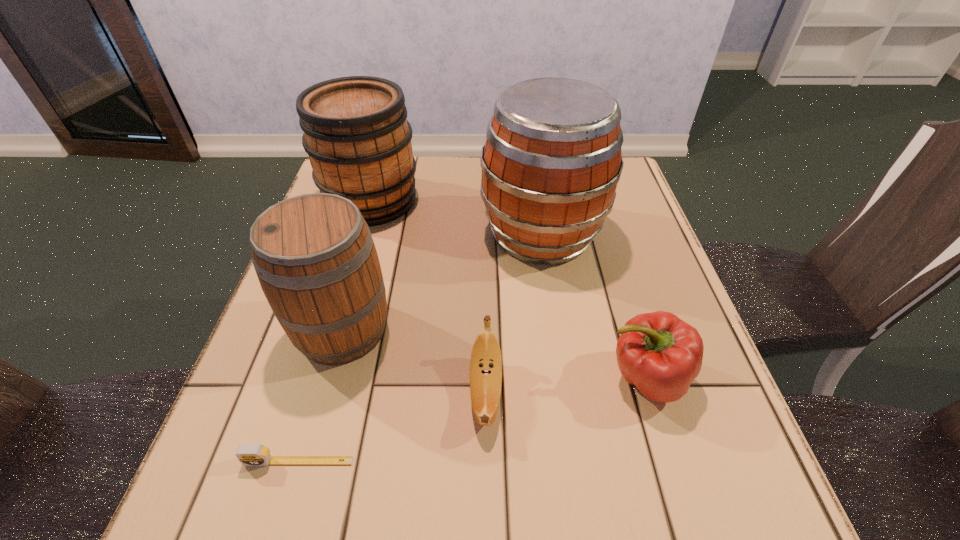
Where is `vacant area that lies between the rightmost cider and the nearest cider`? The height and width of the screenshot is (540, 960). vacant area that lies between the rightmost cider and the nearest cider is located at coordinates (442, 282).

Image resolution: width=960 pixels, height=540 pixels. I want to click on vacant point located between the nearest cider and the rightmost cider, so click(442, 282).

The image size is (960, 540). I want to click on vacant area that lies between the fourth tallest object and the rightmost cider, so click(593, 306).

Identify the location of free point between the banana and the tallest object. This screenshot has width=960, height=540. (514, 312).

Identify the location of vacant region between the fifth tallest object and the tallest object. This screenshot has width=960, height=540. (514, 312).

Where is `blank region between the nearest cider and the second shortest object`? The height and width of the screenshot is (540, 960). blank region between the nearest cider and the second shortest object is located at coordinates pyautogui.click(x=414, y=360).

Image resolution: width=960 pixels, height=540 pixels. In order to click on object that is the second closest one to the nearest cider in this screenshot , I will do `click(486, 363)`.

Identify which object is the nearest to the tape measure. Please provide its 2D coordinates. Your answer should be formatted as a tuple, i.e. [(x, y)], where the tuple contains the x and y coordinates of a point satisfying the conditions above.

[(314, 255)]

Locate which cider is the closest to the nearest cider. Please provide its 2D coordinates. Your answer should be formatted as a tuple, i.e. [(x, y)], where the tuple contains the x and y coordinates of a point satisfying the conditions above.

[(552, 160)]

Locate an element on the screen. the second closest cider relative to the tallest object is located at coordinates (314, 255).